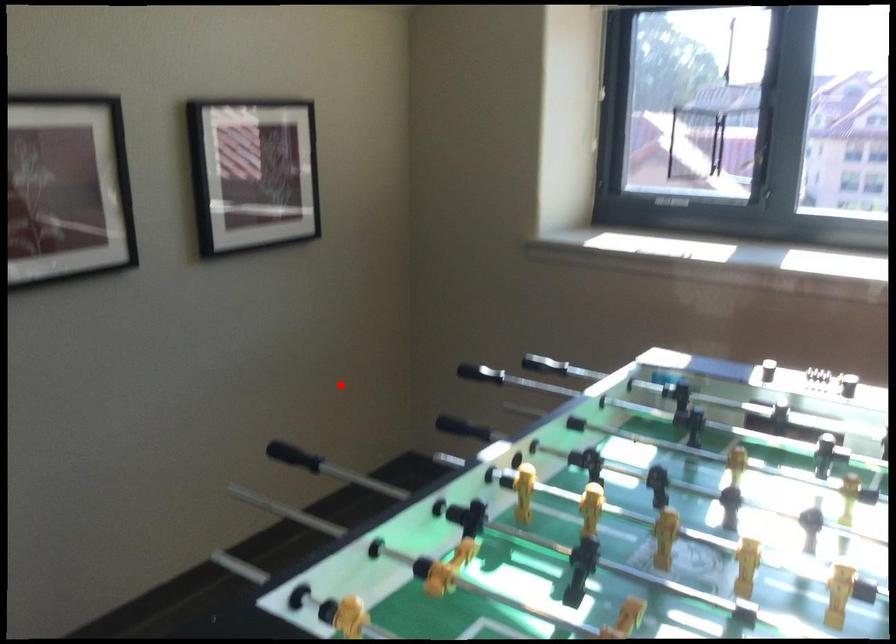
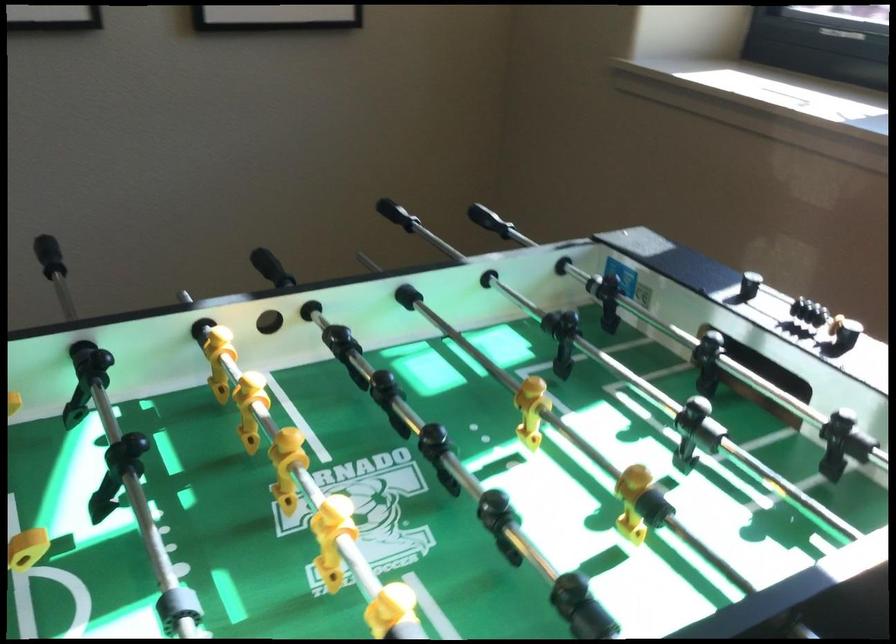
Question: A red point is marked in image1. In image2, is the corresponding 3D point closer to the camera or farther? Reply with the corresponding letter.

Choices:
 (A) The corresponding 3D point is closer.
 (B) The corresponding 3D point is farther.

Answer: (A)